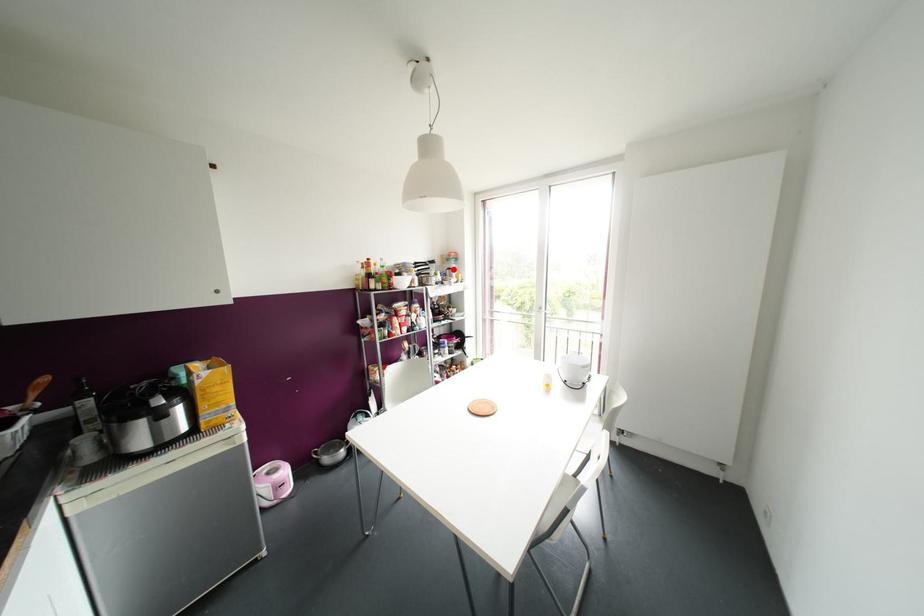
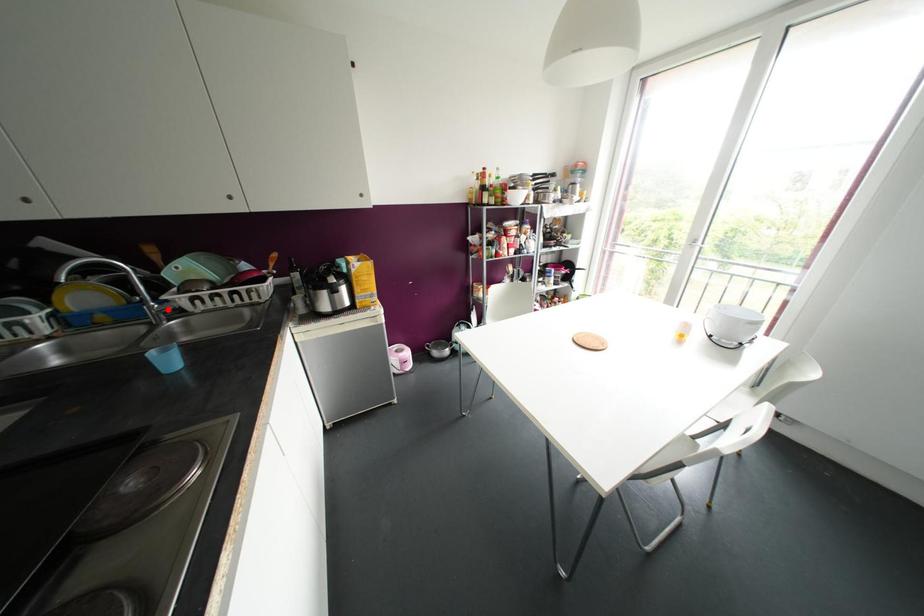
I am providing you with two images of the same scene from different viewpoints. A red point is marked on the first image and another point is marked on the second image. Does the point marked in image1 correspond to the same location as the one in image2?

No